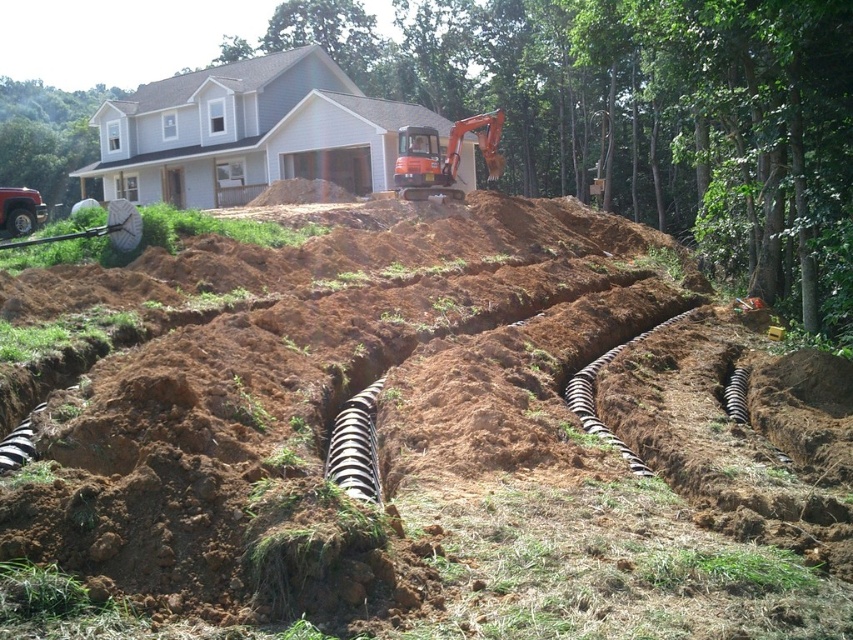
You are a construction worker who needs to determine which object at the center of the site is bigger. Which one is larger between the brown soil at center and the black rubber pipe at center?

The brown soil at center is larger compared to the black rubber pipe at center.

In the scene shown: You are a construction worker who needs to determine if the brown soil at center can be fully covered by the orange rubber excavator at center for a temporary storage. Based on their sizes, is this possible?

The brown soil at center is smaller than the orange rubber excavator at center, so the excavator can fully cover the brown soil at center for temporary storage.

You are standing at the construction site and want to place a safety cone at the closest point to your current position between the two points marked as point (416, 474) and point (444, 161). Which point should you choose?

You should choose point (416, 474) because it is closer to the camera, which represents your current position, compared to point (444, 161).